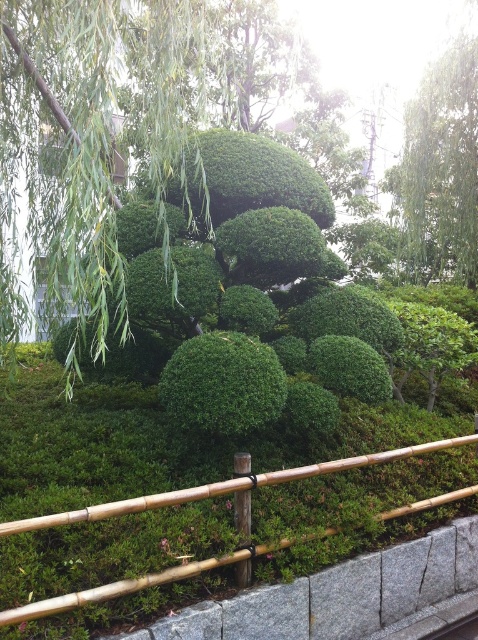
Question: Which of the following is the closest to the observer?

Choices:
 (A) bamboo fence at center
 (B) green leafy bush at center
 (C) gray granite curb at lower center
 (D) green leafy tree at upper right

Answer: (A)

Question: Can you confirm if gray granite curb at lower center is thinner than bamboo fence at center?

Choices:
 (A) yes
 (B) no

Answer: (A)

Question: From the image, what is the correct spatial relationship of green leafy bush at center in relation to bamboo fence at center?

Choices:
 (A) left
 (B) right

Answer: (A)

Question: Which point appears closest to the camera in this image?

Choices:
 (A) (471, 556)
 (B) (428, 182)
 (C) (468, 438)

Answer: (A)

Question: Based on their relative distances, which object is nearer to the bamboo fence at center?

Choices:
 (A) green leafy bush at center
 (B) green leafy tree at upper right
 (C) gray granite curb at lower center

Answer: (C)

Question: Is green leafy bush at center bigger than green leafy tree at upper right?

Choices:
 (A) yes
 (B) no

Answer: (B)